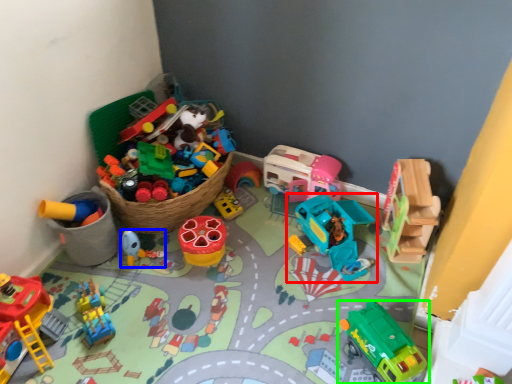
Question: Which object is positioned farthest from toy (highlighted by a red box)? Select from toy (highlighted by a blue box) and toy (highlighted by a green box).

Choices:
 (A) toy
 (B) toy

Answer: (A)